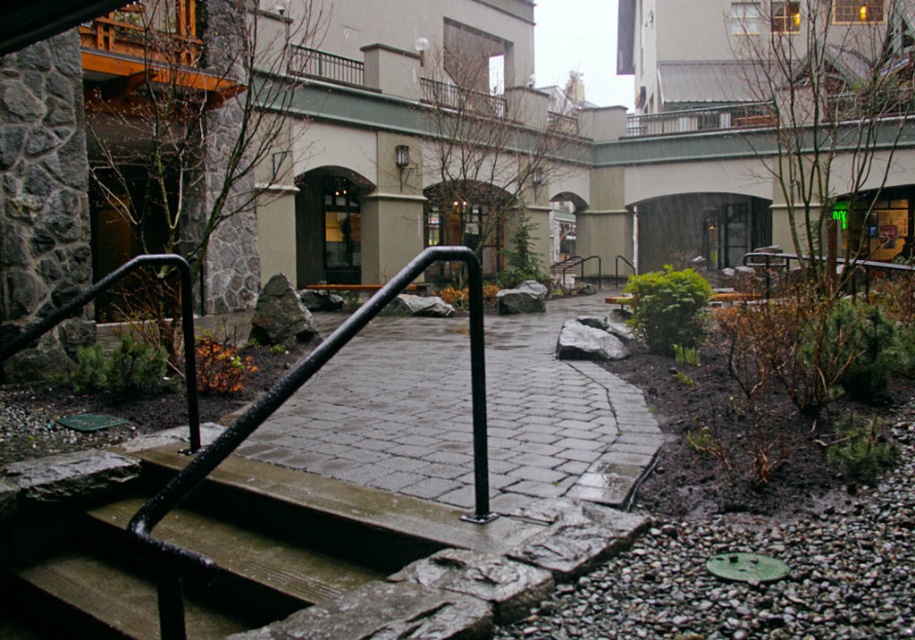
Question: Is black metal railing at center in front of wooden stairs at center?

Choices:
 (A) no
 (B) yes

Answer: (A)

Question: Which object is farther from the camera taking this photo?

Choices:
 (A) black metal railing at center
 (B) wooden stairs at center

Answer: (A)

Question: Can you confirm if black metal railing at center is bigger than wooden stairs at center?

Choices:
 (A) no
 (B) yes

Answer: (A)

Question: Which object is closer to the camera taking this photo?

Choices:
 (A) wooden stairs at center
 (B) black metal railing at center

Answer: (A)

Question: Is black metal railing at center thinner than wooden stairs at center?

Choices:
 (A) yes
 (B) no

Answer: (B)